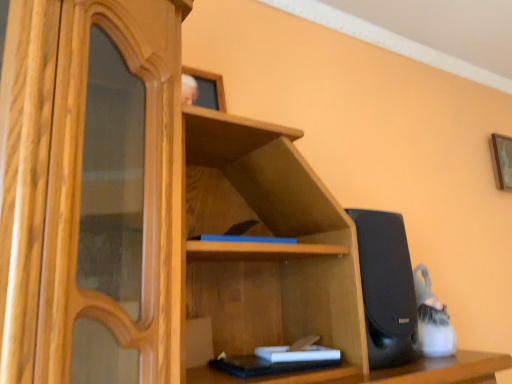
Question: Is white matte book at lower center located within wooden picture frame at upper right?

Choices:
 (A) no
 (B) yes

Answer: (A)

Question: Is wooden picture frame at upper right positioned far away from white matte book at lower center?

Choices:
 (A) no
 (B) yes

Answer: (B)

Question: Is wooden picture frame at upper right positioned behind white matte book at lower center?

Choices:
 (A) no
 (B) yes

Answer: (B)

Question: Could you tell me if wooden picture frame at upper right is turned towards white matte book at lower center?

Choices:
 (A) no
 (B) yes

Answer: (A)

Question: Is wooden picture frame at upper right looking in the opposite direction of white matte book at lower center?

Choices:
 (A) yes
 (B) no

Answer: (B)

Question: From the image's perspective, is wooden picture frame at upper right on top of white matte book at lower center?

Choices:
 (A) no
 (B) yes

Answer: (B)

Question: Is white matte book at lower center located outside wooden picture frame at upper right?

Choices:
 (A) yes
 (B) no

Answer: (A)

Question: Considering the relative sizes of white matte book at lower center and wooden picture frame at upper right in the image provided, is white matte book at lower center wider than wooden picture frame at upper right?

Choices:
 (A) no
 (B) yes

Answer: (B)

Question: Does white matte book at lower center have a lesser height compared to wooden picture frame at upper right?

Choices:
 (A) no
 (B) yes

Answer: (B)

Question: Does white matte book at lower center have a greater height compared to wooden picture frame at upper right?

Choices:
 (A) no
 (B) yes

Answer: (A)

Question: From the image's perspective, is white matte book at lower center on wooden picture frame at upper right?

Choices:
 (A) yes
 (B) no

Answer: (B)

Question: Is white matte book at lower center next to wooden picture frame at upper right and touching it?

Choices:
 (A) no
 (B) yes

Answer: (A)

Question: From a real-world perspective, relative to wooden picture frame at upper right, is white matte book at lower center vertically above or below?

Choices:
 (A) below
 (B) above

Answer: (A)